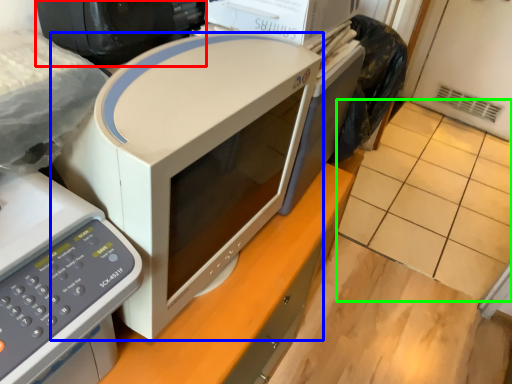
Question: Considering the real-world distances, which object is farthest from desktop computer (highlighted by a red box)? home appliance (highlighted by a blue box) or tile (highlighted by a green box)?

Choices:
 (A) home appliance
 (B) tile

Answer: (B)